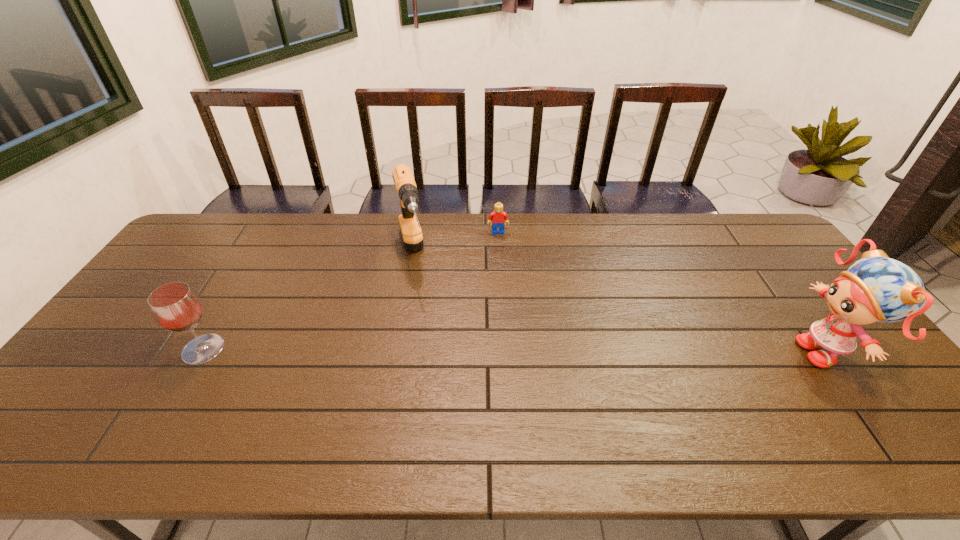
Locate an element on the screen. This screenshot has height=540, width=960. free area in between the leftmost object and the rightmost object is located at coordinates (516, 350).

Identify the location of vacant area between the Lego and the drill. Image resolution: width=960 pixels, height=540 pixels. (455, 243).

Where is `empty space between the second object from right to left and the third object from right to left`? This screenshot has height=540, width=960. empty space between the second object from right to left and the third object from right to left is located at coordinates (455, 243).

Identify which object is the third nearest to the leftmost object. Please provide its 2D coordinates. Your answer should be formatted as a tuple, i.e. [(x, y)], where the tuple contains the x and y coordinates of a point satisfying the conditions above.

[(876, 288)]

Where is `object that is the closest to the drill`? The width and height of the screenshot is (960, 540). object that is the closest to the drill is located at coordinates (x=498, y=216).

The image size is (960, 540). I want to click on free location that satisfies the following two spatial constraints: 1. on the back side of the third tallest object; 2. on the right side of the second object from left to right, so click(x=260, y=253).

Where is `vacant space that satisfies the following two spatial constraints: 1. on the face of the second object from right to left; 2. on the face of the doll`? This screenshot has width=960, height=540. vacant space that satisfies the following two spatial constraints: 1. on the face of the second object from right to left; 2. on the face of the doll is located at coordinates (504, 351).

Image resolution: width=960 pixels, height=540 pixels. Find the location of `free location that satisfies the following two spatial constraints: 1. on the face of the third object from left to right; 2. on the face of the rightmost object`. free location that satisfies the following two spatial constraints: 1. on the face of the third object from left to right; 2. on the face of the rightmost object is located at coordinates point(504,351).

You are a GUI agent. You are given a task and a screenshot of the screen. Output one action in this format:
    pyautogui.click(x=<x>, y=<y>)
    Task: Click on the free spot that satisfies the following two spatial constraints: 1. on the front side of the doll; 2. on the face of the drill
    The width and height of the screenshot is (960, 540).
    Given the screenshot: What is the action you would take?
    pyautogui.click(x=395, y=351)

This screenshot has width=960, height=540. What are the coordinates of `vacant space that satisfies the following two spatial constraints: 1. on the face of the rightmost object; 2. on the face of the Lego` in the screenshot? It's located at (504, 351).